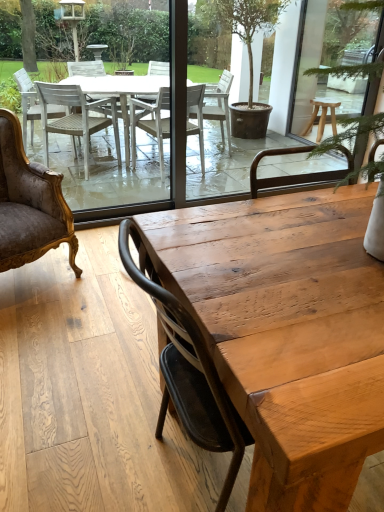
Question: Is velvet gold armchair at left closer to camera compared to natural wood table at center?

Choices:
 (A) yes
 (B) no

Answer: (B)

Question: Does velvet gold armchair at left appear on the left side of natural wood table at center?

Choices:
 (A) yes
 (B) no

Answer: (A)

Question: Can you confirm if velvet gold armchair at left is taller than natural wood table at center?

Choices:
 (A) yes
 (B) no

Answer: (A)

Question: Is velvet gold armchair at left wider than natural wood table at center?

Choices:
 (A) yes
 (B) no

Answer: (B)

Question: Is the surface of velvet gold armchair at left in direct contact with natural wood table at center?

Choices:
 (A) no
 (B) yes

Answer: (A)

Question: Is velvet gold armchair at left turned away from natural wood table at center?

Choices:
 (A) no
 (B) yes

Answer: (A)

Question: Would you say velvet gold armchair at left is part of natural wood table at center's contents?

Choices:
 (A) no
 (B) yes

Answer: (A)

Question: Is natural wood table at center to the left of velvet gold armchair at left from the viewer's perspective?

Choices:
 (A) no
 (B) yes

Answer: (A)

Question: Considering the relative sizes of natural wood table at center and velvet gold armchair at left in the image provided, is natural wood table at center smaller than velvet gold armchair at left?

Choices:
 (A) yes
 (B) no

Answer: (B)

Question: Is the depth of natural wood table at center less than that of velvet gold armchair at left?

Choices:
 (A) yes
 (B) no

Answer: (A)

Question: Is natural wood table at center placed right next to velvet gold armchair at left?

Choices:
 (A) no
 (B) yes

Answer: (A)

Question: Is velvet gold armchair at left at the back of natural wood table at center?

Choices:
 (A) yes
 (B) no

Answer: (B)

Question: In terms of height, does natural wood table at center look taller or shorter compared to velvet gold armchair at left?

Choices:
 (A) short
 (B) tall

Answer: (A)